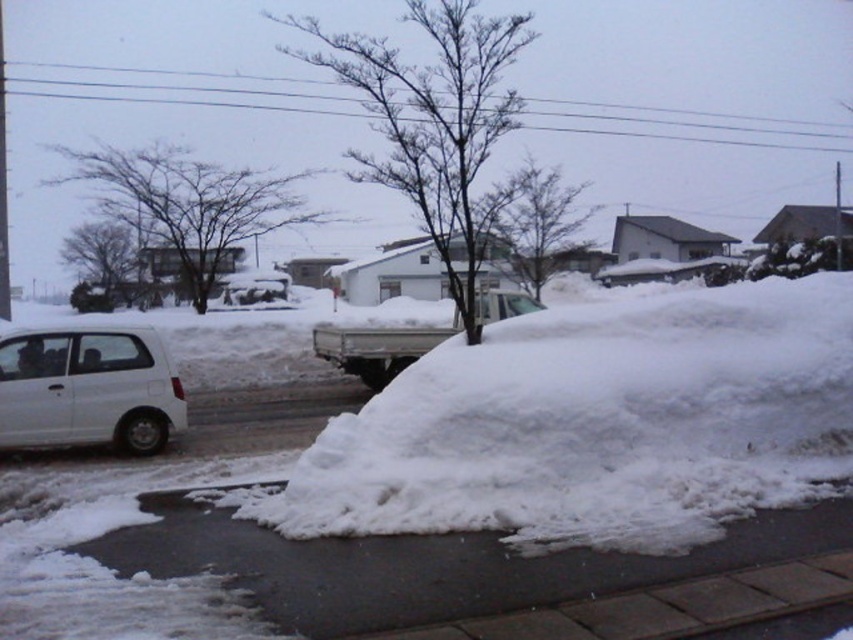
You are a delivery person standing at the edge of the road in the snowy area. You need to deliver a package to the truck. Which object, the white fluffy snow at center or the white matte truck at center, is closer to you?

The white fluffy snow at center is closer to the viewer than the white matte truck at center, so the snow is closer to you.

Looking at this image, you are a delivery person standing at the edge of the road in the snowy area. You need to deliver a package to a house located behind the white snow at lower center. The delivery robot you are using has a maximum range of 15 feet. Can the robot reach the snow pile?

The white snow at lower center is 14.99 feet from the camera, so yes, the delivery robot can reach it since it is within the 15 feet range.

You are a delivery person standing next to the white matte van at left. You need to deliver a package to the doorstep located behind the white fluffy snow at center. The delivery robot you are using has a maximum range of 7 meters. Can the robot reach the doorstep from the van?

The distance between the white fluffy snow at center and the white matte van at left is 6.91 meters, which is within the robot delivery range of 7 meters. Therefore, the robot can reach the doorstep behind the white fluffy snow at center.